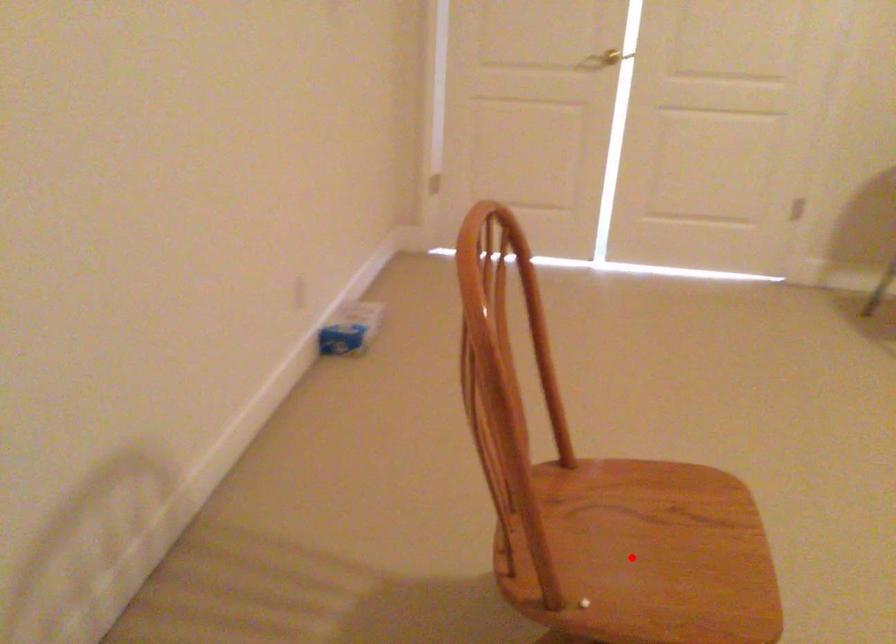
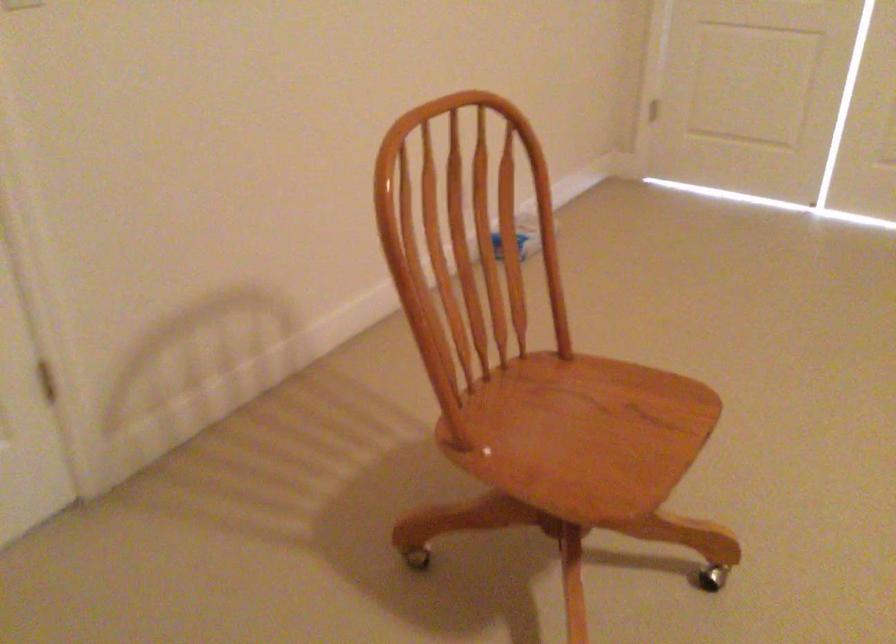
Locate, in the second image, the point that corresponds to the highlighted location in the first image.

(565, 436)